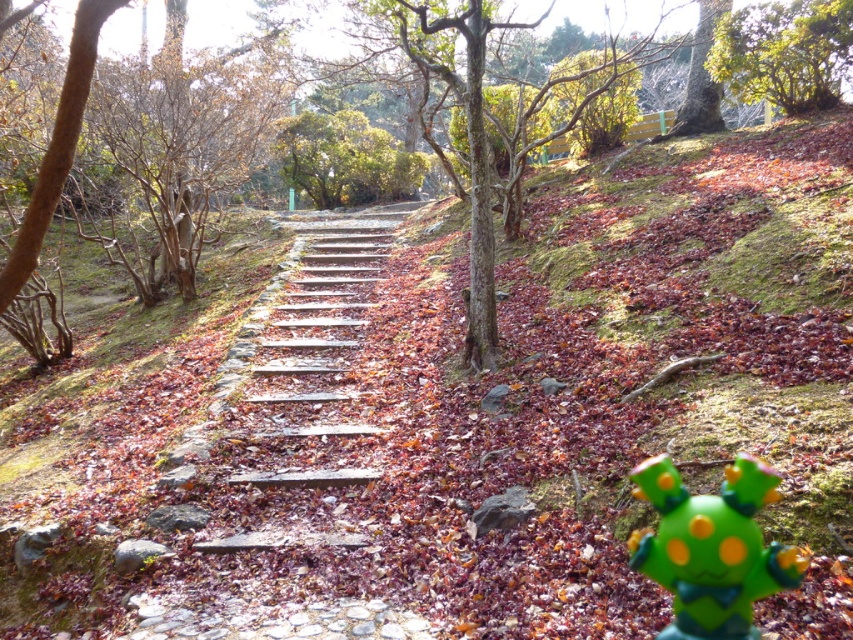
Question: Which object is closer to the camera taking this photo?

Choices:
 (A) wooden steps at center
 (B) green leafy tree at upper right

Answer: (A)

Question: From the image, what is the correct spatial relationship of green leafy tree at upper right in relation to green leafy tree at center?

Choices:
 (A) left
 (B) right

Answer: (B)

Question: Which object is closer to the camera taking this photo?

Choices:
 (A) green leafy tree at upper right
 (B) green leafy tree at center
 (C) wooden steps at center
 (D) green matte toy at lower right

Answer: (D)

Question: Is wooden steps at center positioned in front of green leafy tree at center?

Choices:
 (A) yes
 (B) no

Answer: (A)

Question: Can you confirm if green matte toy at lower right is wider than green leafy tree at center?

Choices:
 (A) yes
 (B) no

Answer: (B)

Question: Estimate the real-world distances between objects in this image. Which object is farther from the green matte toy at lower right?

Choices:
 (A) wooden steps at center
 (B) green leafy tree at upper right
 (C) green leafy tree at center

Answer: (C)